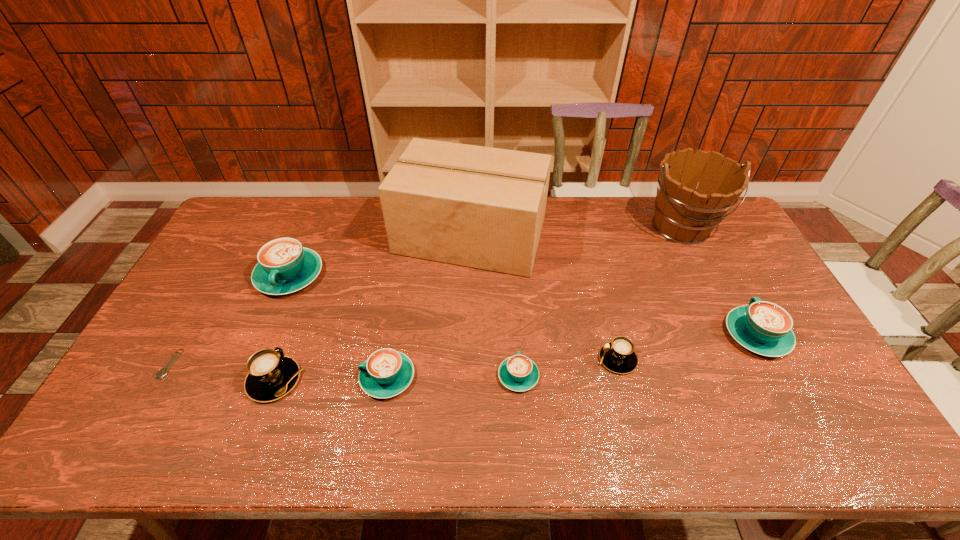
You are a GUI agent. You are given a task and a screenshot of the screen. Output one action in this format:
    pyautogui.click(x=<x>, y=<y>)
    Task: Click on the box at the far edge
    This screenshot has width=960, height=540.
    Given the screenshot: What is the action you would take?
    pyautogui.click(x=481, y=207)

Where is `wine bucket positioned at the far edge`? This screenshot has height=540, width=960. wine bucket positioned at the far edge is located at coordinates (685, 213).

What are the coordinates of `object situated at the left edge` in the screenshot? It's located at (163, 372).

Locate an element on the screen. This screenshot has width=960, height=540. wine bucket that is positioned at the right edge is located at coordinates (685, 213).

The image size is (960, 540). Find the location of `cappuccino located at the right edge`. cappuccino located at the right edge is located at coordinates (765, 328).

Identify the location of object at the far right corner. This screenshot has width=960, height=540. (685, 213).

Locate an element on the screen. vacant area at the far edge of the desktop is located at coordinates (330, 223).

I want to click on free space at the near edge, so click(x=349, y=450).

Locate an element on the screen. free space at the left edge of the desktop is located at coordinates (178, 333).

Identify the location of blank space at the right edge. The width and height of the screenshot is (960, 540). (708, 248).